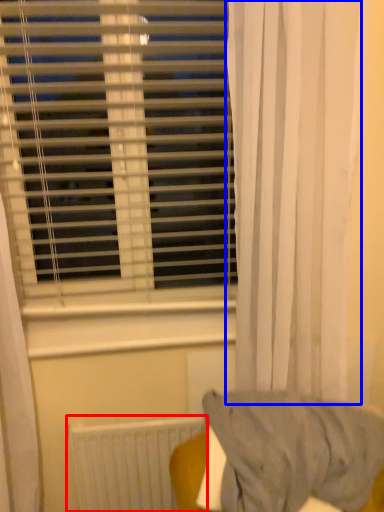
Question: Which object appears closest to the camera in this image, radiator (highlighted by a red box) or curtain (highlighted by a blue box)?

Choices:
 (A) radiator
 (B) curtain

Answer: (B)